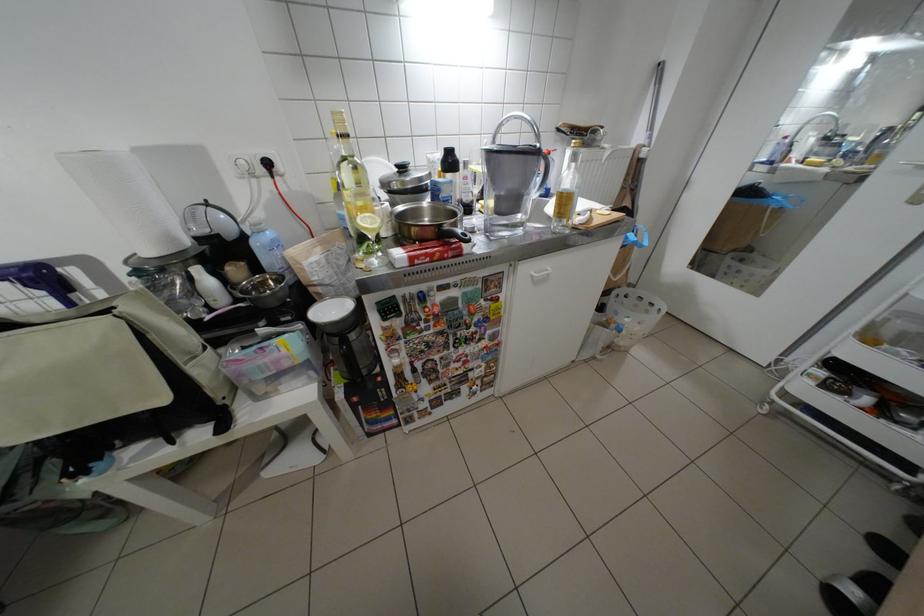
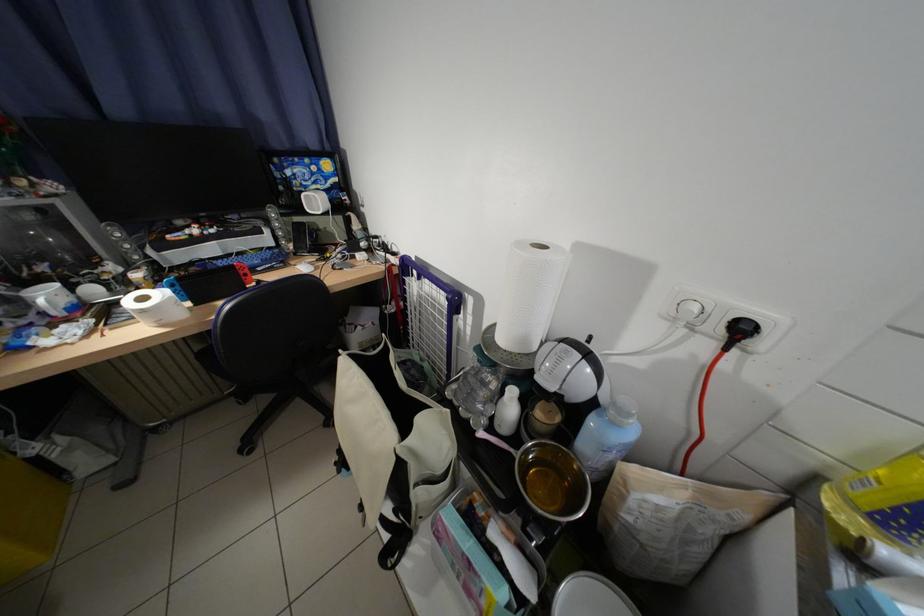
Where in the second image is the point corresponding to (275,171) from the first image?

(734, 333)